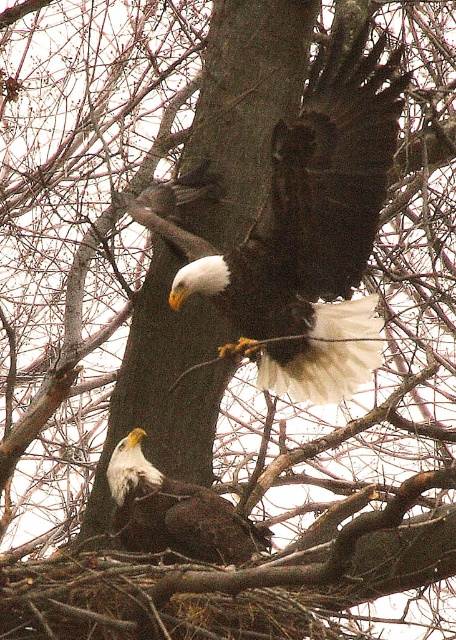
Which is more to the right, dark brown feathers at center or brown rough tree trunk at center?

dark brown feathers at center is more to the right.

Does dark brown feathers at center have a greater width compared to brown rough tree trunk at center?

Correct, the width of dark brown feathers at center exceeds that of brown rough tree trunk at center.

At what (x,y) coordinates should I click in order to perform the action: click on dark brown feathers at center. Please return your answer as a coordinate pair (x, y). Image resolution: width=456 pixels, height=640 pixels. Looking at the image, I should click on (306, 236).

Between point (367, 180) and point (197, 532), which one is positioned in front?

Point (197, 532) is in front.

Find the location of `dark brown feathers at center`. dark brown feathers at center is located at coordinates (306, 236).

Can you confirm if brown rough tree trunk at center is taller than white-feathered bald eagle at lower left?

Correct, brown rough tree trunk at center is much taller as white-feathered bald eagle at lower left.

Can you confirm if brown rough tree trunk at center is shorter than white-feathered bald eagle at lower left?

No.

Locate an element on the screen. This screenshot has width=456, height=640. brown rough tree trunk at center is located at coordinates (244, 104).